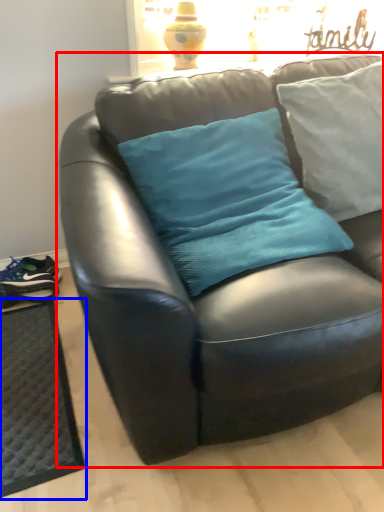
Question: Which of the following is the closest to the observer, studio couch (highlighted by a red box) or doormat (highlighted by a blue box)?

Choices:
 (A) studio couch
 (B) doormat

Answer: (A)